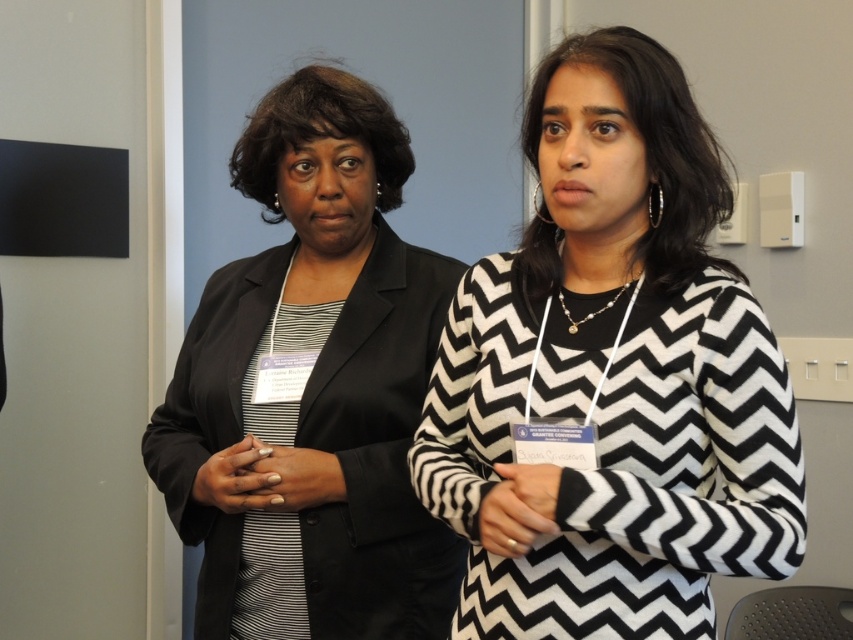
Question: Can you confirm if black and white zigzag sweater at center is positioned to the left of black satin blazer at left?

Choices:
 (A) no
 (B) yes

Answer: (A)

Question: Can you confirm if black and white zigzag sweater at center is positioned to the left of black satin blazer at left?

Choices:
 (A) yes
 (B) no

Answer: (B)

Question: Which object appears closest to the camera in this image?

Choices:
 (A) black and white zigzag sweater at center
 (B) black satin blazer at left

Answer: (A)

Question: Considering the relative positions of black and white zigzag sweater at center and black satin blazer at left in the image provided, where is black and white zigzag sweater at center located with respect to black satin blazer at left?

Choices:
 (A) left
 (B) right

Answer: (B)

Question: Which point appears closest to the camera in this image?

Choices:
 (A) (364, 150)
 (B) (511, 422)

Answer: (B)